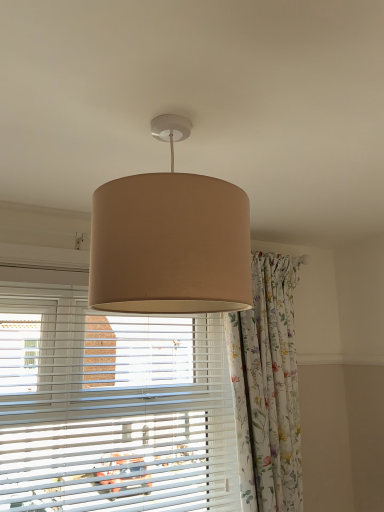
Question: From a real-world perspective, is beige fabric lampshade at center positioned under white plastic blinds at center based on gravity?

Choices:
 (A) yes
 (B) no

Answer: (B)

Question: Does beige fabric lampshade at center contain white plastic blinds at center?

Choices:
 (A) no
 (B) yes

Answer: (A)

Question: From the image's perspective, is beige fabric lampshade at center on top of white plastic blinds at center?

Choices:
 (A) yes
 (B) no

Answer: (A)

Question: Can you confirm if beige fabric lampshade at center is smaller than white plastic blinds at center?

Choices:
 (A) yes
 (B) no

Answer: (A)

Question: Is beige fabric lampshade at center not near white plastic blinds at center?

Choices:
 (A) no
 (B) yes

Answer: (A)

Question: Considering the relative sizes of beige fabric lampshade at center and white plastic blinds at center in the image provided, is beige fabric lampshade at center wider than white plastic blinds at center?

Choices:
 (A) no
 (B) yes

Answer: (B)

Question: Can you confirm if white plastic blinds at center is bigger than floral fabric curtain at center?

Choices:
 (A) no
 (B) yes

Answer: (B)

Question: Considering the relative sizes of white plastic blinds at center and floral fabric curtain at center in the image provided, is white plastic blinds at center wider than floral fabric curtain at center?

Choices:
 (A) no
 (B) yes

Answer: (A)

Question: Can we say white plastic blinds at center lies outside floral fabric curtain at center?

Choices:
 (A) no
 (B) yes

Answer: (B)

Question: Are white plastic blinds at center and floral fabric curtain at center far apart?

Choices:
 (A) no
 (B) yes

Answer: (A)

Question: From a real-world perspective, is white plastic blinds at center over floral fabric curtain at center?

Choices:
 (A) yes
 (B) no

Answer: (B)

Question: Is white plastic blinds at center further to camera compared to floral fabric curtain at center?

Choices:
 (A) no
 (B) yes

Answer: (A)

Question: Could you tell me if floral fabric curtain at center is facing beige fabric lampshade at center?

Choices:
 (A) yes
 (B) no

Answer: (B)